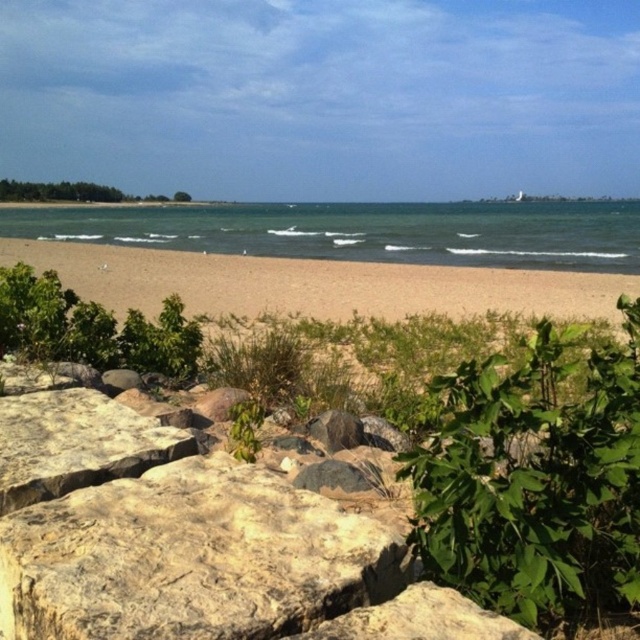
Is green leafy plant at center to the left of blue water at center from the viewer's perspective?

Correct, you'll find green leafy plant at center to the left of blue water at center.

Between green leafy plant at center and blue water at center, which one is positioned lower?

green leafy plant at center is lower down.

Find the location of `green leafy plant at center`. green leafy plant at center is located at coordinates (536, 480).

Can you confirm if green leafy bush at lower left is taller than green leafy shrubs at left?

Incorrect, green leafy bush at lower left's height is not larger of green leafy shrubs at left's.

Who is more distant from viewer, (166, 358) or (12, 195)?

Positioned behind is point (12, 195).

Between point (182, 344) and point (19, 184), which one is positioned behind?

The point (19, 184) is more distant.

The width and height of the screenshot is (640, 640). Identify the location of green leafy bush at lower left. (92, 328).

Does brown sandy beach at center have a lesser height compared to smooth gray rock at center?

No, brown sandy beach at center is not shorter than smooth gray rock at center.

Between point (307, 273) and point (509, 632), which one is positioned behind?

The point (307, 273) is more distant.

The height and width of the screenshot is (640, 640). What do you see at coordinates (314, 284) in the screenshot?
I see `brown sandy beach at center` at bounding box center [314, 284].

Find the location of `brown sandy beach at center`. brown sandy beach at center is located at coordinates (314, 284).